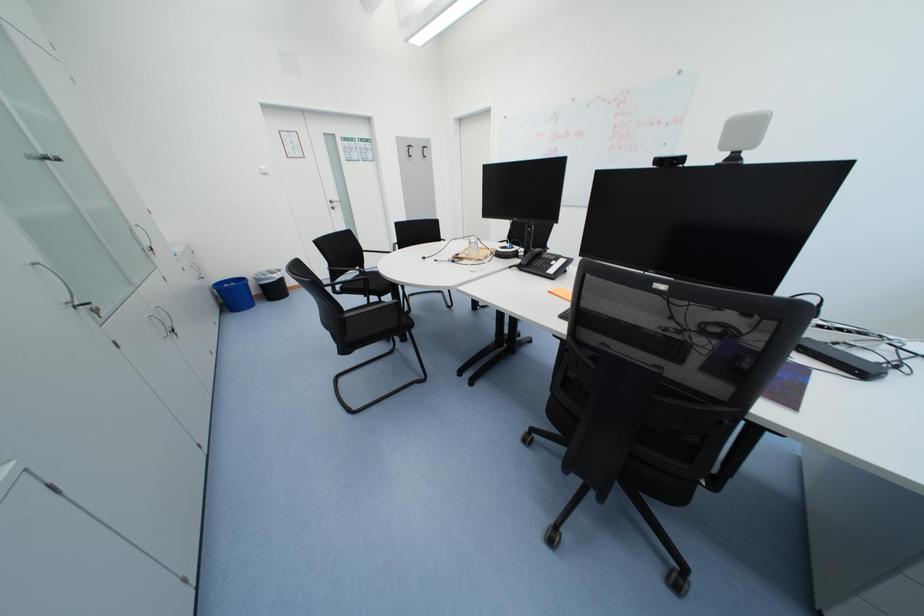
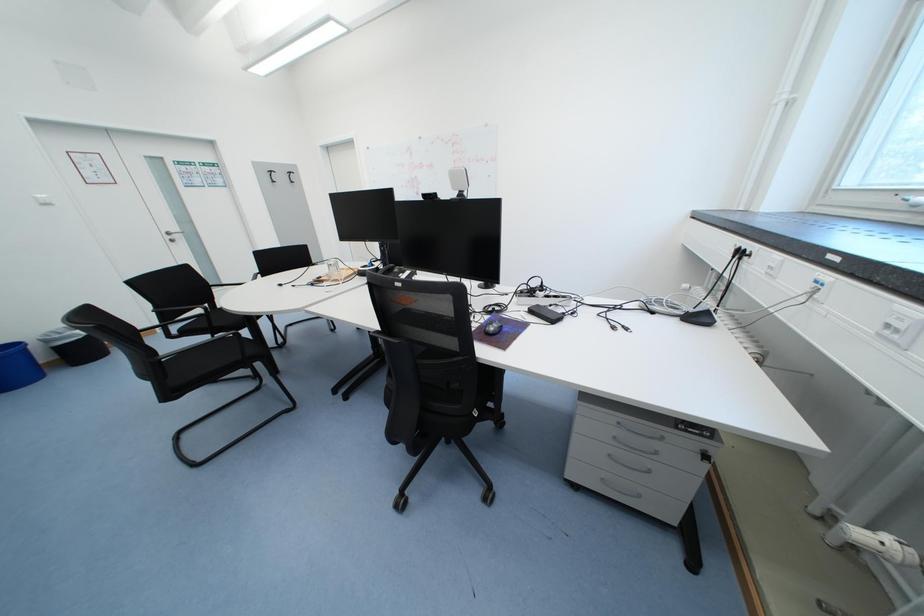
Question: The images are taken continuously from a first-person perspective. In which direction is your viewpoint rotating?

Choices:
 (A) Left
 (B) Right
 (C) Up
 (D) Down

Answer: (B)